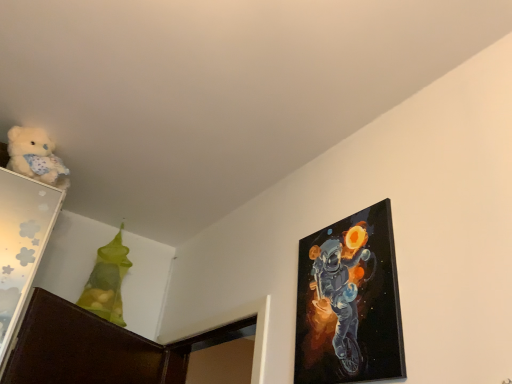
Question: Is fluffy white teddy bear at upper left closer to the viewer compared to glossy canvas painting at upper right?

Choices:
 (A) no
 (B) yes

Answer: (A)

Question: Is fluffy white teddy bear at upper left further to the viewer compared to glossy canvas painting at upper right?

Choices:
 (A) yes
 (B) no

Answer: (A)

Question: Can you confirm if fluffy white teddy bear at upper left is taller than glossy canvas painting at upper right?

Choices:
 (A) no
 (B) yes

Answer: (A)

Question: Considering the relative positions of fluffy white teddy bear at upper left and glossy canvas painting at upper right in the image provided, is fluffy white teddy bear at upper left to the right of glossy canvas painting at upper right from the viewer's perspective?

Choices:
 (A) yes
 (B) no

Answer: (B)

Question: Considering the relative sizes of fluffy white teddy bear at upper left and glossy canvas painting at upper right in the image provided, is fluffy white teddy bear at upper left thinner than glossy canvas painting at upper right?

Choices:
 (A) no
 (B) yes

Answer: (A)

Question: Is point [x=104, y=273] positioned closer to the camera than point [x=62, y=170]?

Choices:
 (A) farther
 (B) closer

Answer: (A)

Question: Would you say translucent green bag at upper left is to the left or to the right of fluffy white teddy bear at upper left in the picture?

Choices:
 (A) left
 (B) right

Answer: (B)

Question: Relative to fluffy white teddy bear at upper left, is translucent green bag at upper left in front or behind?

Choices:
 (A) behind
 (B) front

Answer: (A)

Question: In terms of width, does translucent green bag at upper left look wider or thinner when compared to fluffy white teddy bear at upper left?

Choices:
 (A) wide
 (B) thin

Answer: (A)

Question: From a real-world perspective, is glossy canvas painting at upper right physically located above or below fluffy white teddy bear at upper left?

Choices:
 (A) above
 (B) below

Answer: (B)

Question: Is glossy canvas painting at upper right inside the boundaries of fluffy white teddy bear at upper left, or outside?

Choices:
 (A) inside
 (B) outside

Answer: (B)

Question: Looking at their shapes, would you say glossy canvas painting at upper right is wider or thinner than fluffy white teddy bear at upper left?

Choices:
 (A) thin
 (B) wide

Answer: (A)

Question: From the image's perspective, is glossy canvas painting at upper right located above or below fluffy white teddy bear at upper left?

Choices:
 (A) below
 (B) above

Answer: (A)

Question: Would you say fluffy white teddy bear at upper left is inside or outside translucent green bag at upper left?

Choices:
 (A) outside
 (B) inside

Answer: (A)

Question: From the image's perspective, is fluffy white teddy bear at upper left positioned above or below translucent green bag at upper left?

Choices:
 (A) below
 (B) above

Answer: (B)